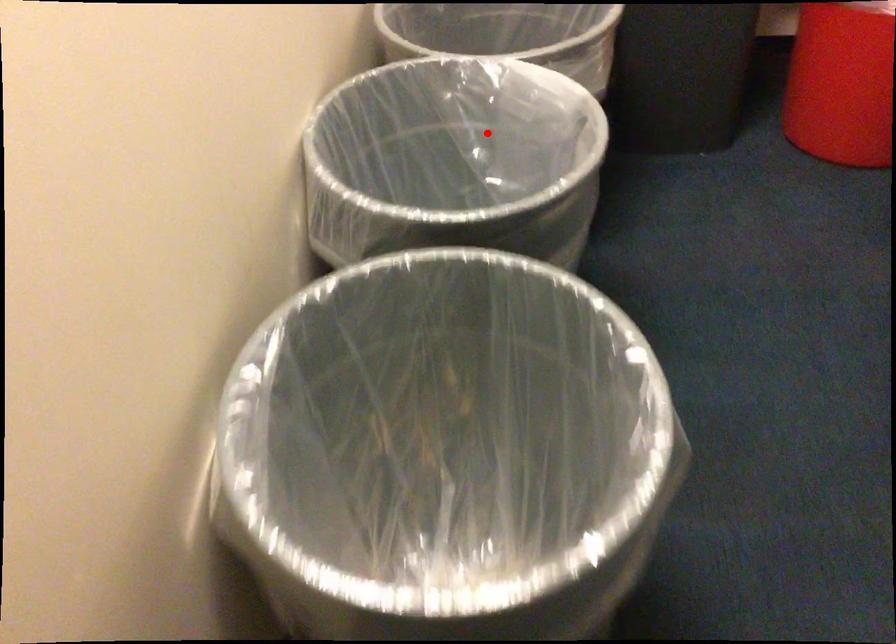
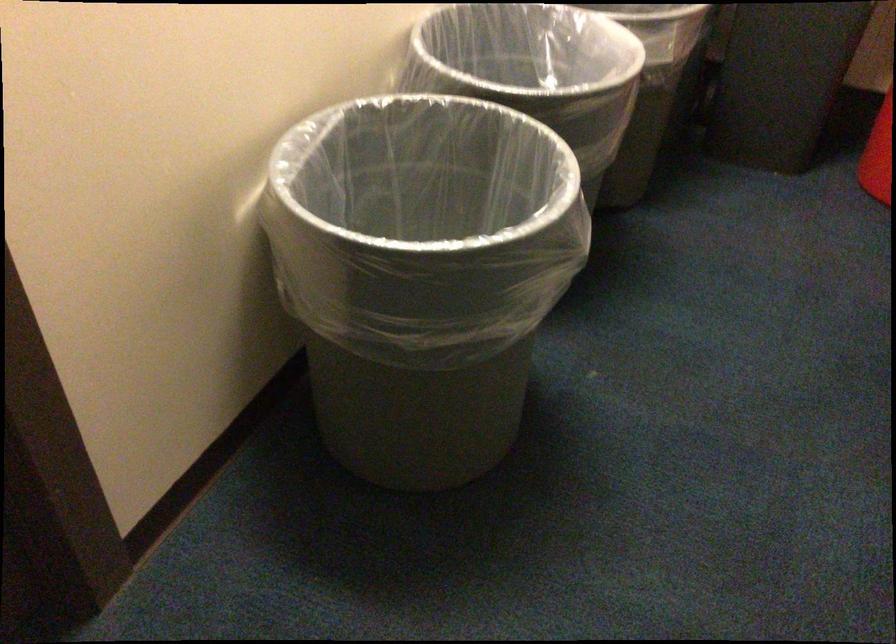
In the second image, find the point that corresponds to the highlighted location in the first image.

(562, 67)